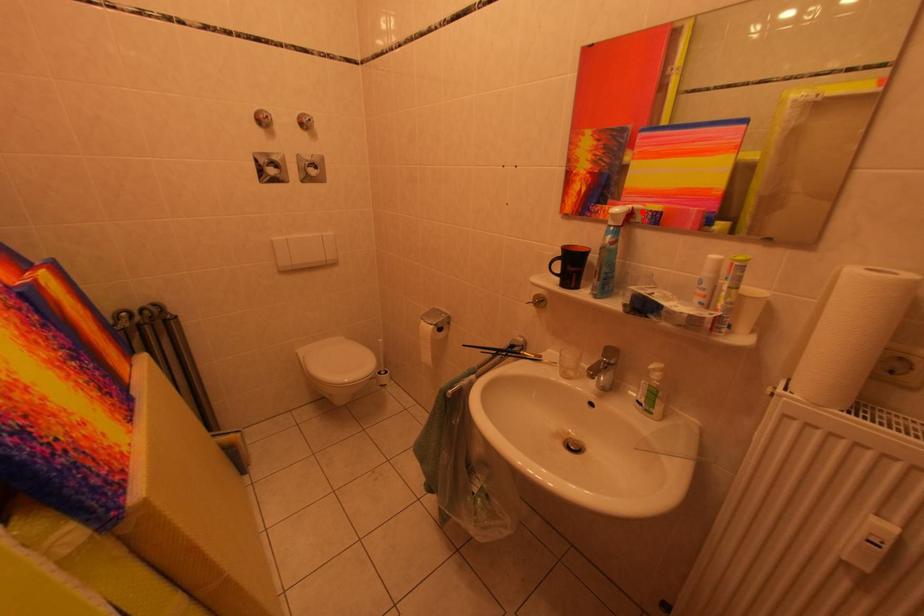
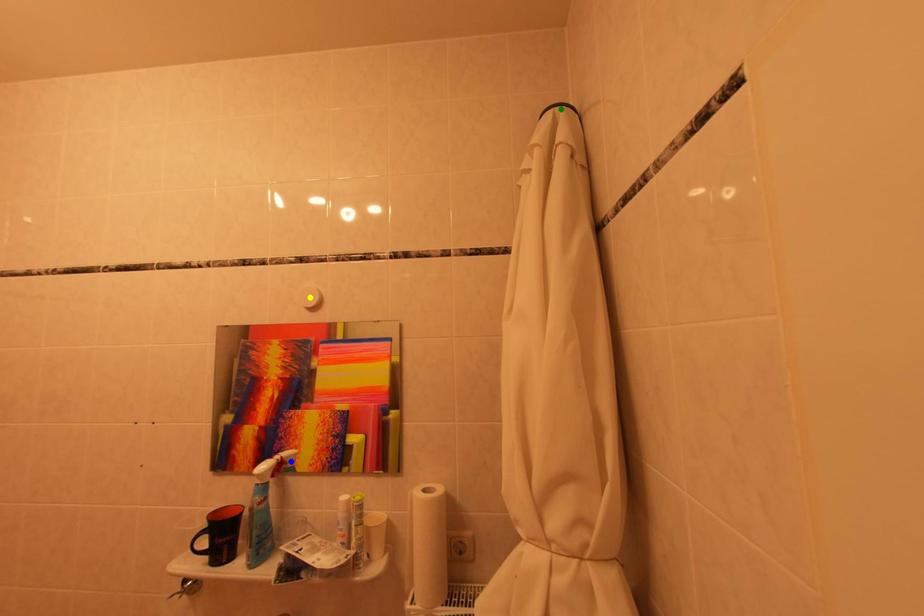
Question: I am providing you with two images of the same scene from different viewpoints. A red point is marked on the first image. You are given multiple points on the second image. Which point in image 2 is actually the same real-world point as the red point in image 1?

Choices:
 (A) blue point
 (B) green point
 (C) yellow point

Answer: (A)